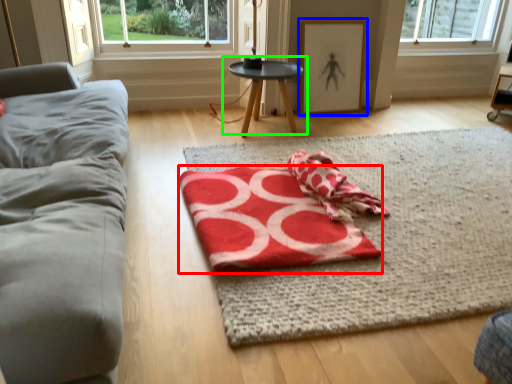
Question: Which object is positioned closest to beach towel (highlighted by a red box)? Select from picture frame (highlighted by a blue box) and table (highlighted by a green box).

Choices:
 (A) picture frame
 (B) table

Answer: (B)